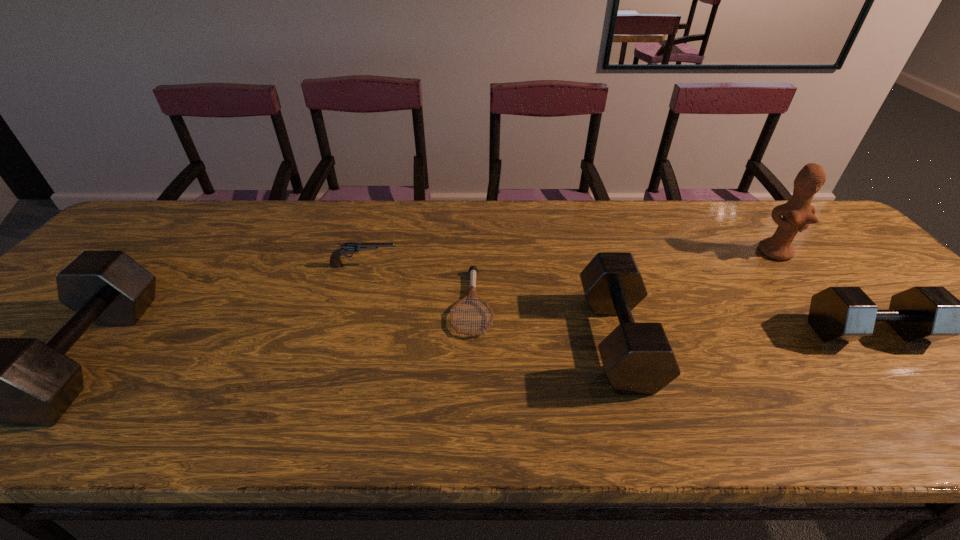
The image size is (960, 540). Find the location of `free space at the right edge of the desktop`. free space at the right edge of the desktop is located at coordinates (825, 280).

The height and width of the screenshot is (540, 960). Find the location of `vacant region between the second farthest object and the third object from left to right`. vacant region between the second farthest object and the third object from left to right is located at coordinates (419, 285).

Locate an element on the screen. The width and height of the screenshot is (960, 540). vacant area that lies between the tennis racket and the fifth object from right to left is located at coordinates (419, 285).

I want to click on unoccupied area between the gun and the shortest object, so (419, 285).

The height and width of the screenshot is (540, 960). Identify the location of blank region between the third object from right to left and the farthest object. (697, 296).

This screenshot has width=960, height=540. Identify the location of empty space between the fourth object from left to right and the fourth object from right to left. (545, 321).

The height and width of the screenshot is (540, 960). What are the coordinates of `the second closest object to the fifth tallest object` in the screenshot? It's located at (16, 382).

Choose which object is the second nearest neighbor to the shortest dumbbell. Please provide its 2D coordinates. Your answer should be formatted as a tuple, i.e. [(x, y)], where the tuple contains the x and y coordinates of a point satisfying the conditions above.

[(638, 359)]

The width and height of the screenshot is (960, 540). Identify the location of dumbbell that stands as the second closest to the second tallest dumbbell. (16, 382).

Identify the location of the closest dumbbell relative to the fourth object from left to right. [838, 313].